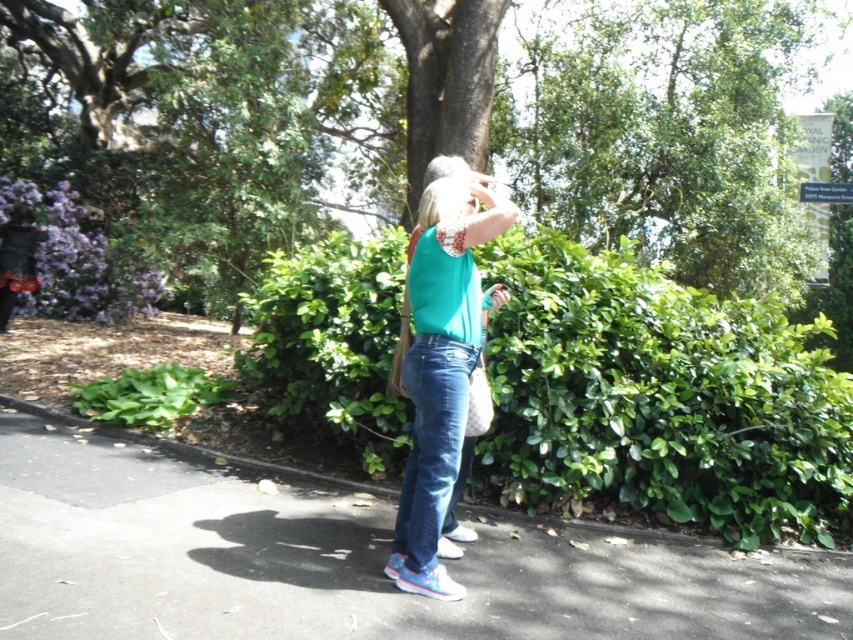
Which is above, black asphalt pavement at center or teal fabric at center?

teal fabric at center

Is black asphalt pavement at center above teal fabric at center?

Actually, black asphalt pavement at center is below teal fabric at center.

Image resolution: width=853 pixels, height=640 pixels. In order to click on black asphalt pavement at center in this screenshot , I will do `click(344, 563)`.

Between green leafy hedge at center and matte teal tank top at center, which one appears on the left side from the viewer's perspective?

matte teal tank top at center

Does point (811, 337) come farther from viewer compared to point (497, 221)?

Yes, point (811, 337) is behind point (497, 221).

This screenshot has height=640, width=853. What are the coordinates of `green leafy hedge at center` in the screenshot? It's located at (660, 400).

Who is taller, green leafy hedge at center or black asphalt pavement at center?

green leafy hedge at center

Measure the distance between green leafy hedge at center and black asphalt pavement at center.

6.70 feet

Is point (746, 332) positioned after point (125, 496)?

Yes.

This screenshot has height=640, width=853. In order to click on green leafy hedge at center in this screenshot , I will do `click(660, 400)`.